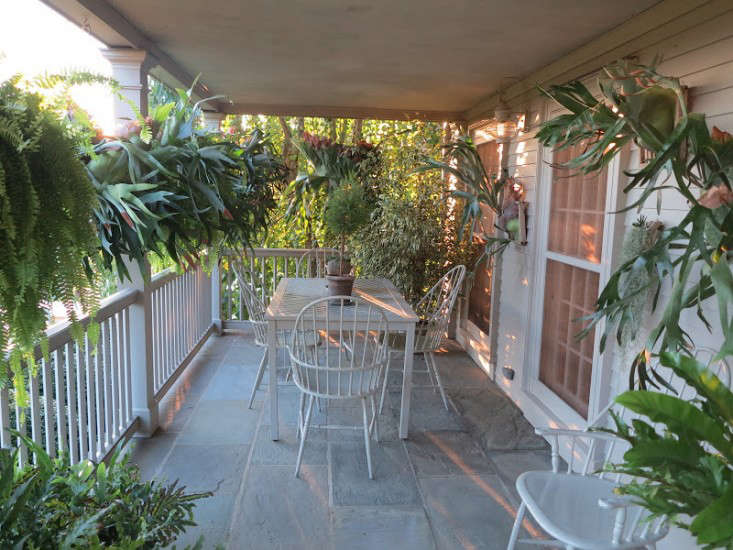
Image resolution: width=733 pixels, height=550 pixels. Identify the location of ceiling. (323, 52).